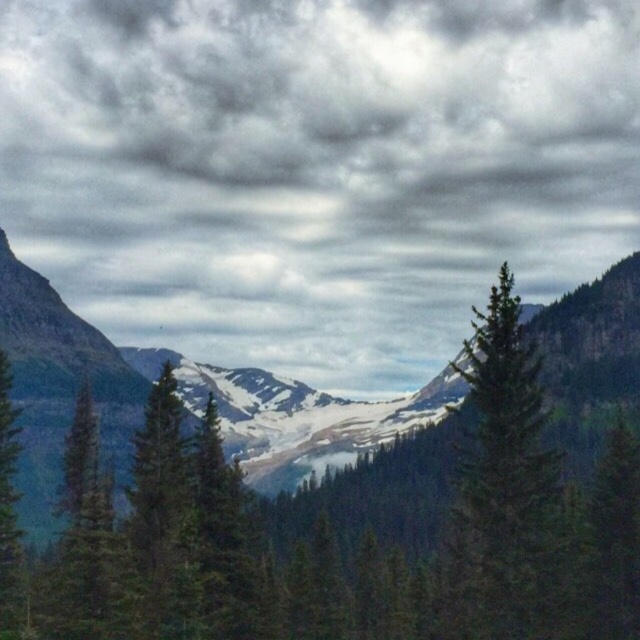
Question: Does cloudy sky at upper center have a smaller size compared to green matte tree at left?

Choices:
 (A) yes
 (B) no

Answer: (B)

Question: Does green matte tree at center appear under green matte tree at left?

Choices:
 (A) yes
 (B) no

Answer: (A)

Question: Which object appears farthest from the camera in this image?

Choices:
 (A) green matte tree at center
 (B) green matte tree at left
 (C) cloudy sky at upper center

Answer: (C)

Question: Does cloudy sky at upper center appear under green matte tree at left?

Choices:
 (A) no
 (B) yes

Answer: (A)

Question: Which object appears closest to the camera in this image?

Choices:
 (A) green matte tree at center
 (B) cloudy sky at upper center
 (C) green matte tree at left

Answer: (A)

Question: Considering the real-world distances, which object is farthest from the green matte tree at left?

Choices:
 (A) green matte tree at center
 (B) cloudy sky at upper center

Answer: (B)